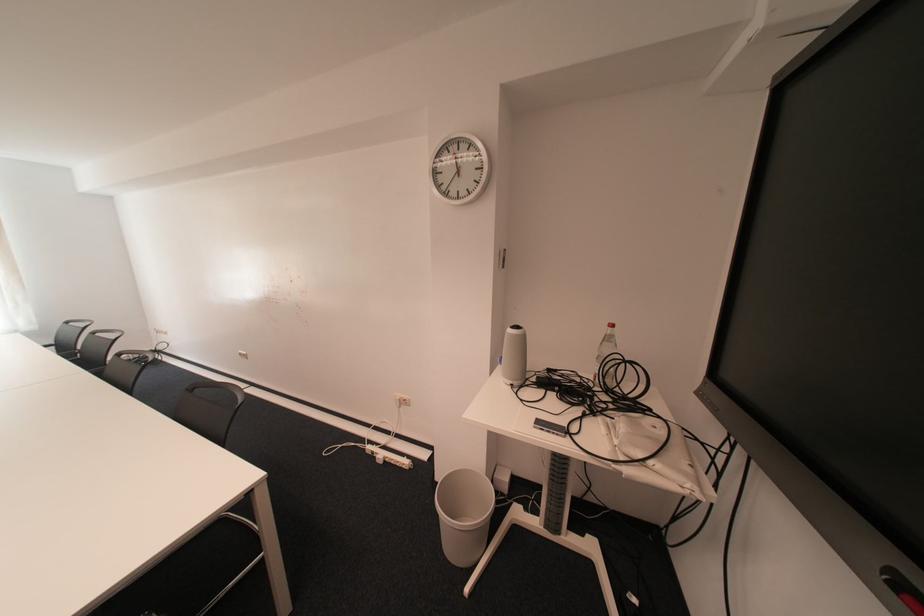
Locate an element on the screen. This screenshot has width=924, height=616. grey trash can is located at coordinates (464, 515).